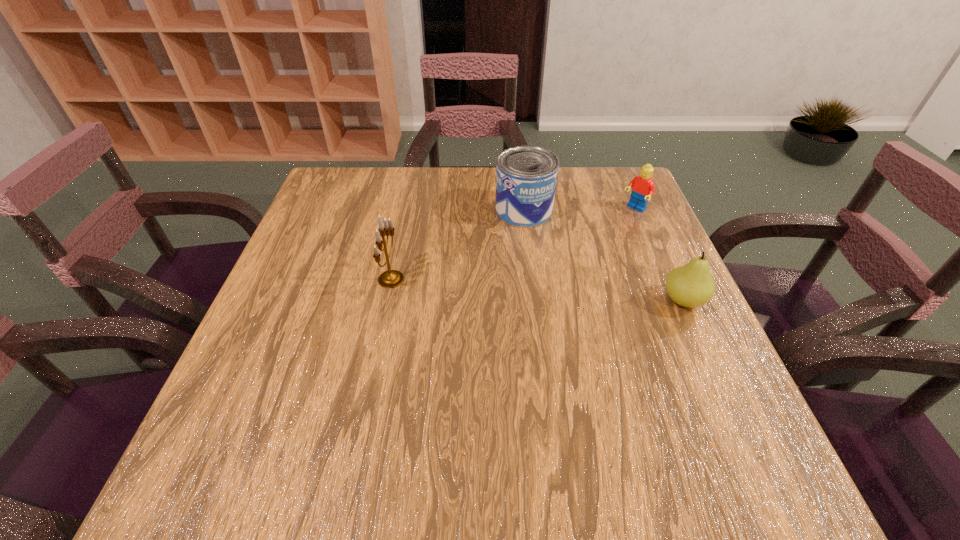
The width and height of the screenshot is (960, 540). I want to click on vacant space situated on the face of the Lego, so click(610, 230).

Image resolution: width=960 pixels, height=540 pixels. What are the coordinates of `free spot located on the face of the Lego` in the screenshot? It's located at (588, 248).

The width and height of the screenshot is (960, 540). In order to click on vacant position located on the face of the Lego in this screenshot , I will do `click(574, 260)`.

Where is `can situated at the far edge`? Image resolution: width=960 pixels, height=540 pixels. can situated at the far edge is located at coordinates (526, 176).

Locate an element on the screen. Image resolution: width=960 pixels, height=540 pixels. Lego that is positioned at the far edge is located at coordinates (643, 187).

What are the coordinates of `pear that is positioned at the right edge` in the screenshot? It's located at (691, 285).

At what (x,y) coordinates should I click in order to perform the action: click on Lego positioned at the right edge. Please return your answer as a coordinate pair (x, y). Looking at the image, I should click on (643, 187).

Where is `object that is at the far right corner`? object that is at the far right corner is located at coordinates (643, 187).

In the image, there is a desktop. At what (x,y) coordinates should I click in order to perform the action: click on vacant space at the far edge. Please return your answer as a coordinate pair (x, y). The width and height of the screenshot is (960, 540). Looking at the image, I should click on (392, 171).

Find the location of `free region at the near edge of the desktop`. free region at the near edge of the desktop is located at coordinates (330, 395).